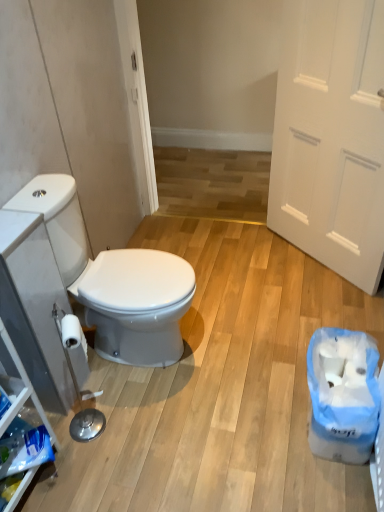
I want to click on free space to the back side of blue plastic bag at lower right, so click(x=286, y=347).